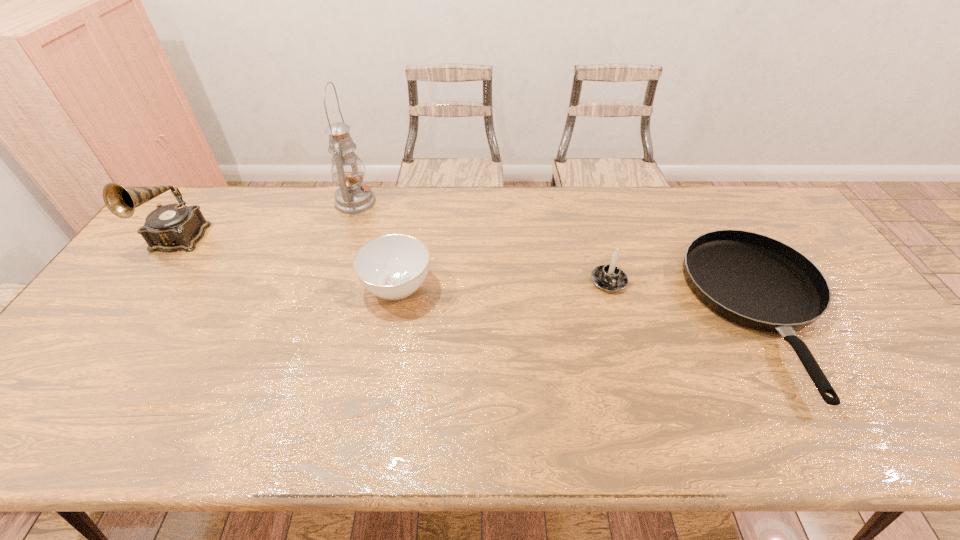
You are a GUI agent. You are given a task and a screenshot of the screen. Output one action in this format:
    pyautogui.click(x=<x>, y=<y>)
    Task: Click on the object present at the near right corner
    The width and height of the screenshot is (960, 540).
    Given the screenshot: What is the action you would take?
    pyautogui.click(x=753, y=280)

Identify the location of vacant space at the far edge of the desktop. (375, 195).

Identify the location of vacant space at the near edge. (358, 448).

Where is `blank area at the left edge`? Image resolution: width=960 pixels, height=540 pixels. blank area at the left edge is located at coordinates (136, 271).

I want to click on free space at the near left corner of the desktop, so click(18, 428).

Where is `vacant space at the far right corner of the desktop`? vacant space at the far right corner of the desktop is located at coordinates (739, 191).

Image resolution: width=960 pixels, height=540 pixels. I want to click on free spot between the fourth object from right to left and the fourth shortest object, so click(267, 220).

Locate an element on the screen. The image size is (960, 540). blank region between the frying pan and the tallest object is located at coordinates click(x=560, y=258).

The height and width of the screenshot is (540, 960). I want to click on empty space between the shortest object and the oil lamp, so click(560, 258).

Locate an element on the screen. free space between the fourth shortest object and the oil lamp is located at coordinates (267, 220).